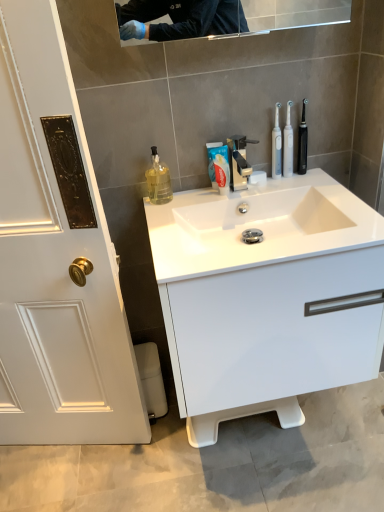
Where is `free space in front of black plastic toothbrush at right, the 2th toothbrush positioned from the left`? free space in front of black plastic toothbrush at right, the 2th toothbrush positioned from the left is located at coordinates (317, 187).